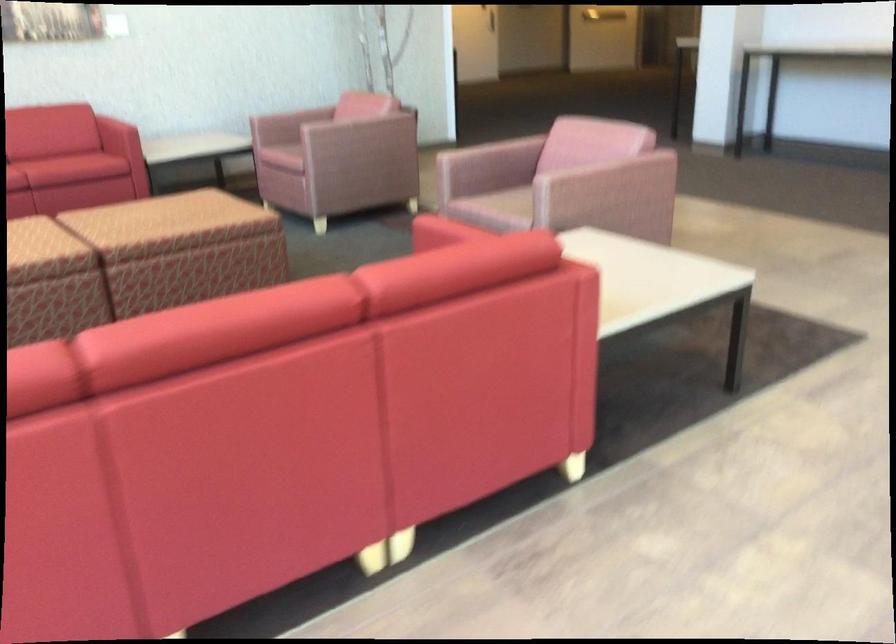
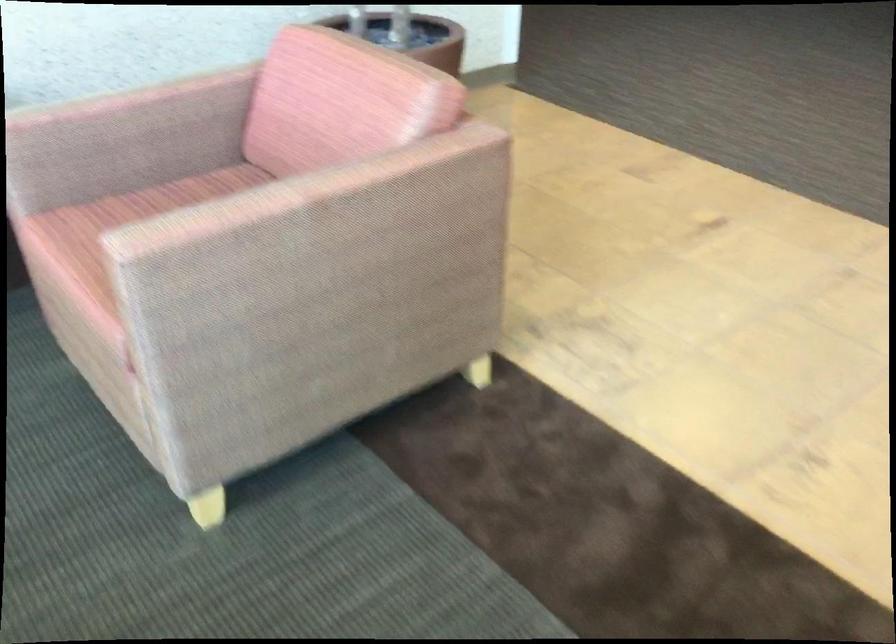
Locate, in the second image, the point that corresponds to point 355,102 in the first image.

(298, 192)